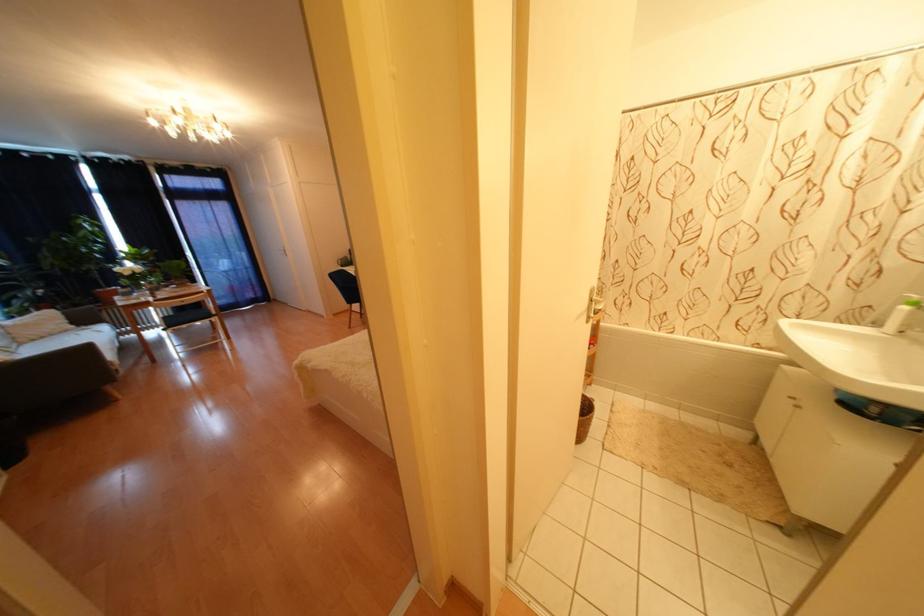
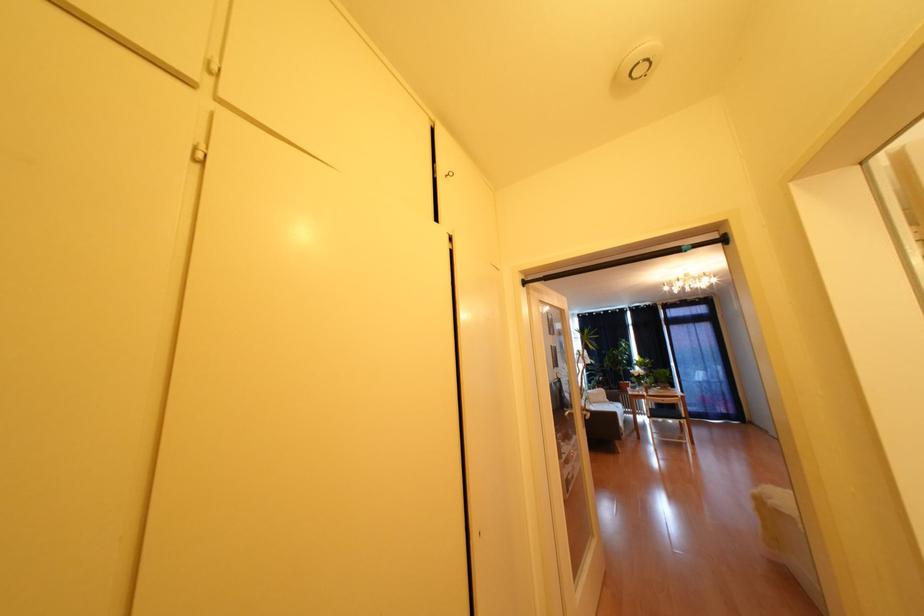
Question: The camera is either moving clockwise (left) or counter-clockwise (right) around the object. The first image is from the beginning of the video and the second image is from the end. Is the camera moving left or right when shooting the video?

Choices:
 (A) Left
 (B) Right

Answer: (B)